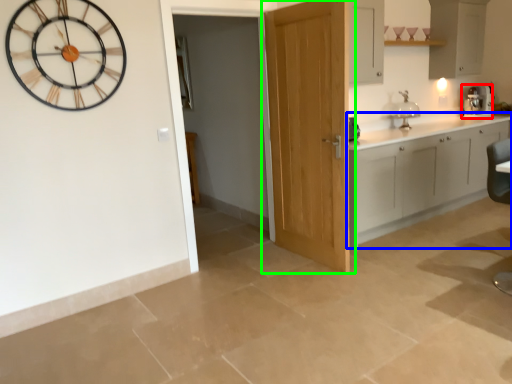
Question: Which is farther away from coffee machine (highlighted by a red box)? cabinetry (highlighted by a blue box) or door (highlighted by a green box)?

Choices:
 (A) cabinetry
 (B) door

Answer: (B)